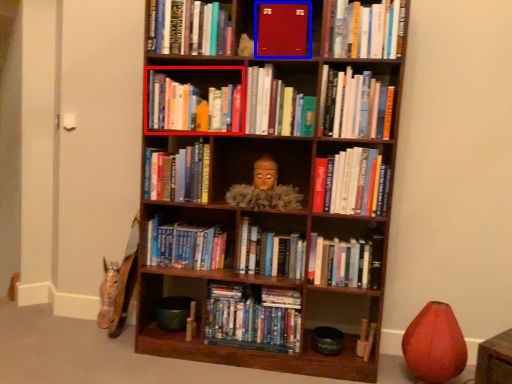
Question: Which of the following is the farthest to the observer, book (highlighted by a red box) or book (highlighted by a blue box)?

Choices:
 (A) book
 (B) book

Answer: (A)